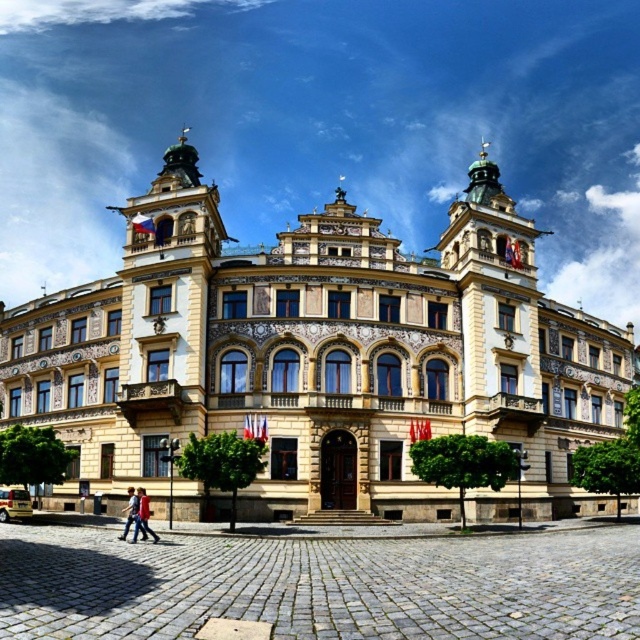
Question: Which point is farther to the camera?

Choices:
 (A) yellow stone building at center
 (B) brown cobblestone square at center
 (C) gray cobblestone square at center
 (D) red shirt at lower left

Answer: (A)

Question: Where is gray cobblestone square at center located in relation to red shirt at lower left in the image?

Choices:
 (A) left
 (B) right

Answer: (B)

Question: Is brown cobblestone square at center smaller than red shirt at lower left?

Choices:
 (A) yes
 (B) no

Answer: (B)

Question: Which point appears closest to the camera in this image?

Choices:
 (A) (1, 577)
 (B) (186, 170)
 (C) (131, 488)

Answer: (A)

Question: Is yellow stone building at center thinner than red jacket at lower left?

Choices:
 (A) no
 (B) yes

Answer: (A)

Question: Which of the following is the closest to the observer?

Choices:
 (A) brown cobblestone square at center
 (B) red shirt at lower left
 (C) red jacket at lower left

Answer: (A)